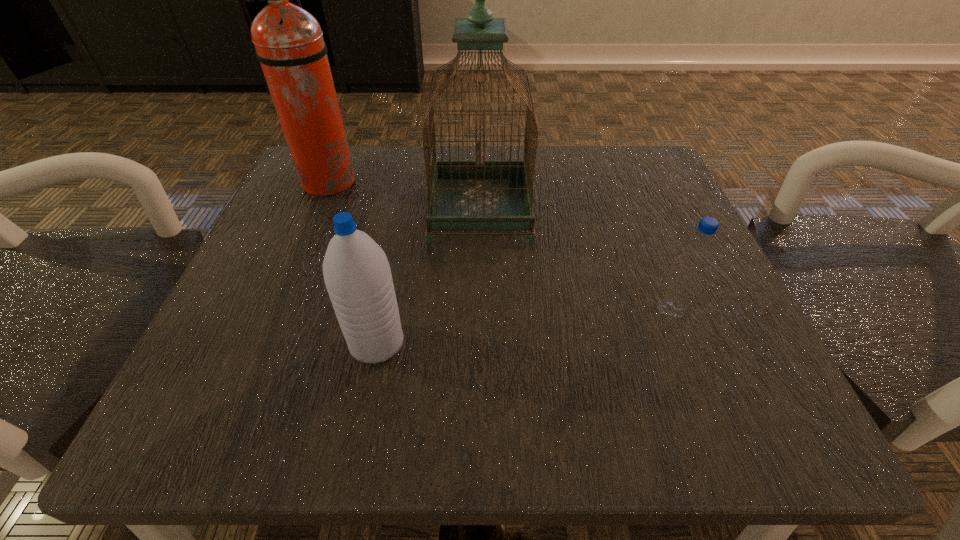
Find the location of a particular element. free space that satisfies the following two spatial constraints: 1. on the back side of the third tallest object; 2. at the nozzle of the leftmost object is located at coordinates (408, 183).

Image resolution: width=960 pixels, height=540 pixels. What are the coordinates of `vacant region that satisfies the following two spatial constraints: 1. at the door of the birdcage; 2. on the back side of the shortest object` in the screenshot? It's located at (480, 310).

The width and height of the screenshot is (960, 540). I want to click on free space that satisfies the following two spatial constraints: 1. on the back side of the shorter water bottle; 2. at the door of the birdcage, so click(631, 211).

The height and width of the screenshot is (540, 960). Identify the location of free point that satisfies the following two spatial constraints: 1. at the door of the second object from right to left; 2. on the left side of the right water bottle. (480, 310).